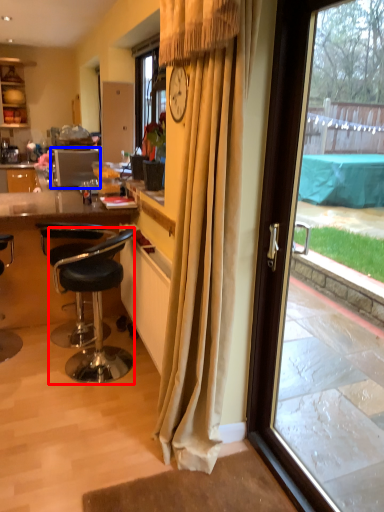
Question: Which point is closer to the camera, chair (highlighted by a red box) or kitchen appliance (highlighted by a blue box)?

Choices:
 (A) chair
 (B) kitchen appliance

Answer: (A)